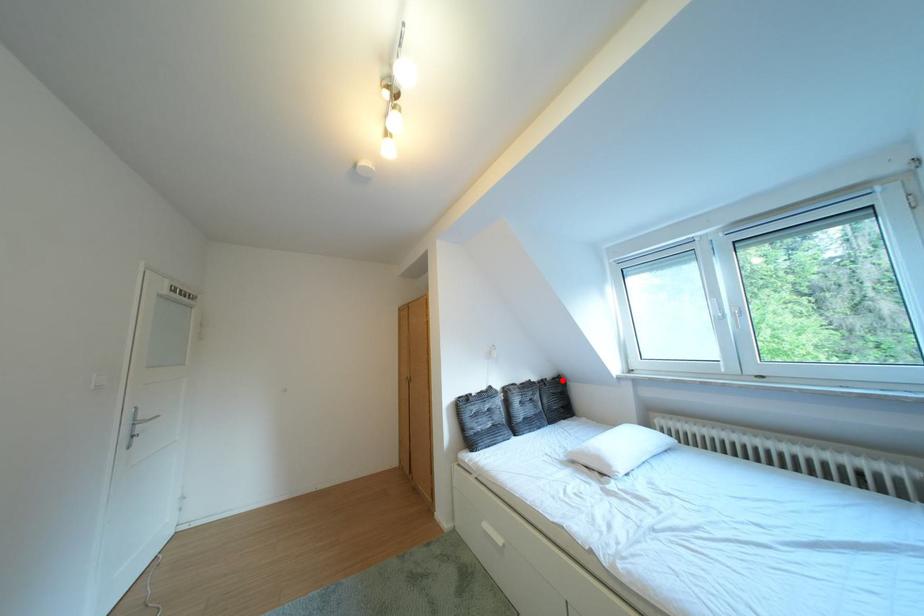
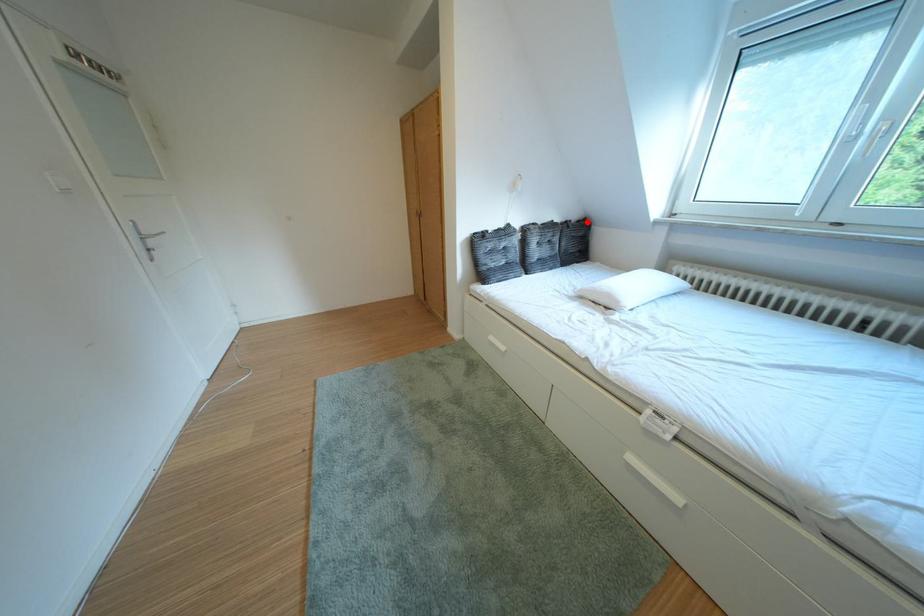
I am providing you with two images of the same scene from different viewpoints. A red point is marked on the first image and another point is marked on the second image. Is the marked point in image1 the same physical position as the marked point in image2?

Yes